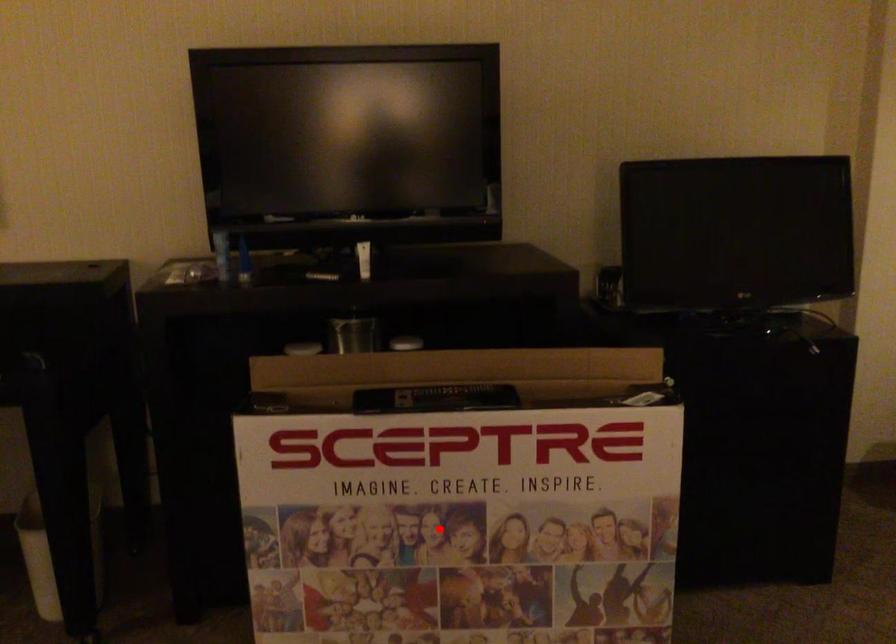
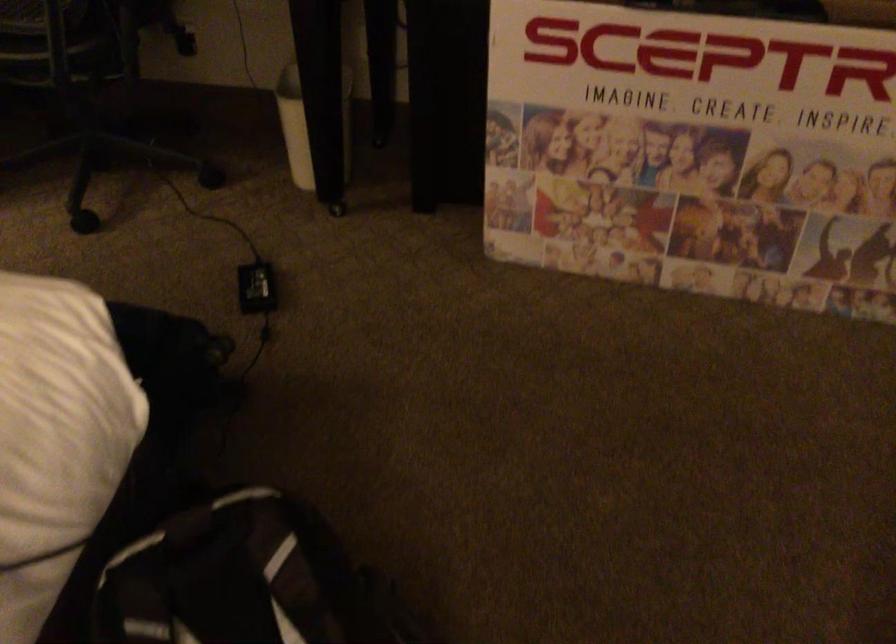
Locate, in the second image, the point that corresponds to the highlighted location in the first image.

(692, 149)